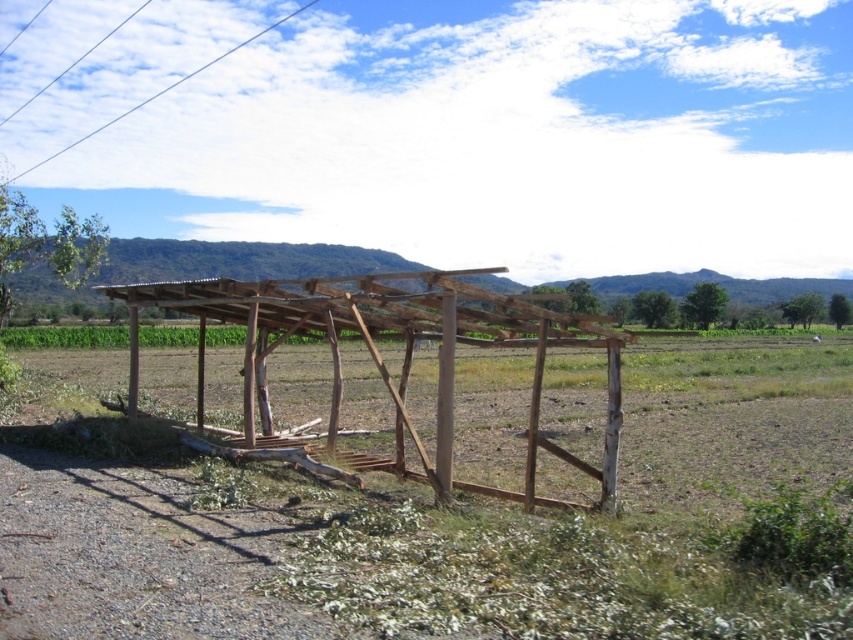
Question: Which of the following is the farthest from the observer?

Choices:
 (A) white wire at upper left
 (B) brown wooden structure at center

Answer: (A)

Question: Does brown wooden structure at center appear on the left side of white wire at upper left?

Choices:
 (A) yes
 (B) no

Answer: (B)

Question: Which point is farther to the camera?

Choices:
 (A) (88, 134)
 (B) (248, 356)

Answer: (A)

Question: Considering the relative positions of brown wooden structure at center and white wire at upper left in the image provided, where is brown wooden structure at center located with respect to white wire at upper left?

Choices:
 (A) above
 (B) below

Answer: (B)

Question: Does brown wooden structure at center appear on the right side of white wire at upper left?

Choices:
 (A) yes
 (B) no

Answer: (A)